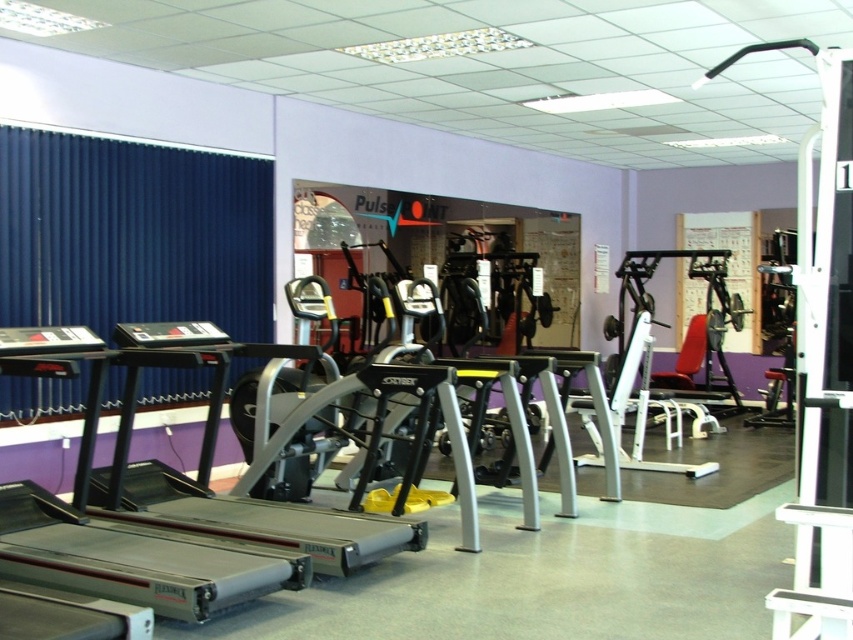
Can you confirm if silver metallic treadmill at lower left is positioned to the right of silver metallic treadmill at center?

No, silver metallic treadmill at lower left is not to the right of silver metallic treadmill at center.

Is silver metallic treadmill at lower left thinner than silver metallic treadmill at center?

Indeed, silver metallic treadmill at lower left has a lesser width compared to silver metallic treadmill at center.

Does point (45, 545) come behind point (125, 360)?

No, it is in front of (125, 360).

Identify the location of silver metallic treadmill at lower left. (115, 529).

Who is taller, metallic silver weight machine at right or silver metallic treadmill at center?

metallic silver weight machine at right

Which is below, metallic silver weight machine at right or silver metallic treadmill at center?

Positioned lower is silver metallic treadmill at center.

The height and width of the screenshot is (640, 853). Identify the location of metallic silver weight machine at right. (821, 364).

Where is `metallic silver weight machine at right`? metallic silver weight machine at right is located at coordinates (821, 364).

Can you confirm if metallic silver weight machine at right is positioned to the left of silver metallic treadmill at lower left?

In fact, metallic silver weight machine at right is to the right of silver metallic treadmill at lower left.

Describe the element at coordinates (821, 364) in the screenshot. I see `metallic silver weight machine at right` at that location.

Find the location of a particular element. The image size is (853, 640). metallic silver weight machine at right is located at coordinates (821, 364).

Locate an element on the screen. This screenshot has height=640, width=853. metallic silver weight machine at right is located at coordinates (821, 364).